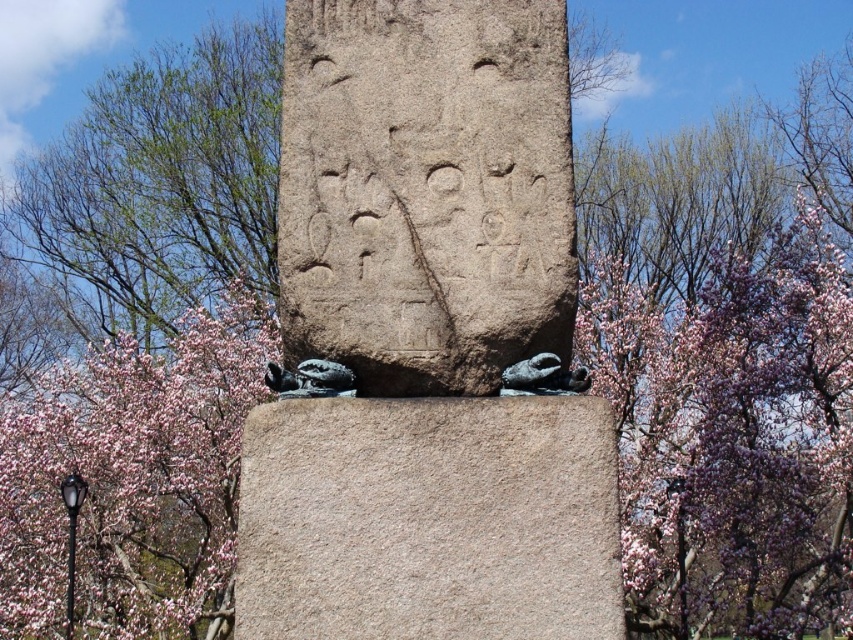
Question: Is pink blossoms at upper right wider than pink blossom tree at center?

Choices:
 (A) yes
 (B) no

Answer: (B)

Question: Which point is farther to the camera?

Choices:
 (A) (492, 397)
 (B) (260, 509)

Answer: (A)

Question: Is pink blossoms at upper right behind smooth gray stone at center?

Choices:
 (A) yes
 (B) no

Answer: (A)

Question: Does smooth gray stone at center have a greater width compared to pink blossom tree at center?

Choices:
 (A) no
 (B) yes

Answer: (A)

Question: Which point is farther to the camera?

Choices:
 (A) (329, 481)
 (B) (772, 486)
 (C) (535, 214)
 (D) (33, 424)

Answer: (D)

Question: Estimate the real-world distances between objects in this image. Which object is closer to the pink blossom tree at center?

Choices:
 (A) gray stone monument at center
 (B) pink blossoms at upper right

Answer: (B)